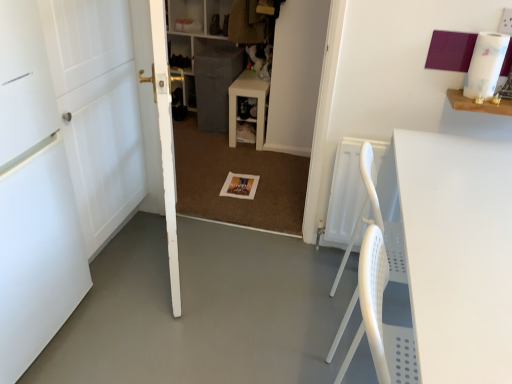
In order to click on free space on the front side of gray fabric cabinet at center in this screenshot , I will do `click(210, 143)`.